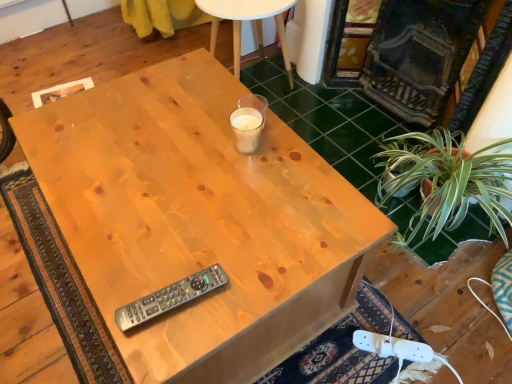
Question: Would you say natural wood desk at center contains white paper cup at center, positioned as the first coffee cup in top-to-bottom order?

Choices:
 (A) no
 (B) yes

Answer: (A)

Question: Can you see natural wood desk at center touching white paper cup at center, positioned as the first coffee cup in top-to-bottom order?

Choices:
 (A) yes
 (B) no

Answer: (B)

Question: Is natural wood desk at center positioned far away from white paper cup at center, the 2th coffee cup in the bottom-to-top sequence?

Choices:
 (A) yes
 (B) no

Answer: (B)

Question: From the image's perspective, is natural wood desk at center over white paper cup at center, positioned as the first coffee cup in top-to-bottom order?

Choices:
 (A) yes
 (B) no

Answer: (B)

Question: From a real-world perspective, does natural wood desk at center stand above white paper cup at center, positioned as the first coffee cup in top-to-bottom order?

Choices:
 (A) yes
 (B) no

Answer: (B)

Question: Is natural wood desk at center positioned beyond the bounds of white paper cup at center, the 2th coffee cup in the bottom-to-top sequence?

Choices:
 (A) yes
 (B) no

Answer: (A)

Question: Does clear glass candle at upper center have a smaller size compared to translucent glass candle at center, the 2th coffee cup when ordered from top to bottom?

Choices:
 (A) no
 (B) yes

Answer: (A)

Question: Is clear glass candle at upper center located outside translucent glass candle at center, marked as the first coffee cup in a bottom-to-top arrangement?

Choices:
 (A) no
 (B) yes

Answer: (B)

Question: Is clear glass candle at upper center shorter than translucent glass candle at center, marked as the first coffee cup in a bottom-to-top arrangement?

Choices:
 (A) no
 (B) yes

Answer: (A)

Question: Does clear glass candle at upper center turn towards translucent glass candle at center, the 2th coffee cup when ordered from top to bottom?

Choices:
 (A) no
 (B) yes

Answer: (A)

Question: Considering the relative positions of clear glass candle at upper center and translucent glass candle at center, the 2th coffee cup when ordered from top to bottom, in the image provided, is clear glass candle at upper center to the left of translucent glass candle at center, the 2th coffee cup when ordered from top to bottom, from the viewer's perspective?

Choices:
 (A) yes
 (B) no

Answer: (A)

Question: Is clear glass candle at upper center touching translucent glass candle at center, the 2th coffee cup when ordered from top to bottom?

Choices:
 (A) yes
 (B) no

Answer: (B)

Question: From the image's perspective, is translucent glass candle at center, the 2th coffee cup when ordered from top to bottom, located beneath white paper cup at center, positioned as the first coffee cup in top-to-bottom order?

Choices:
 (A) no
 (B) yes

Answer: (B)